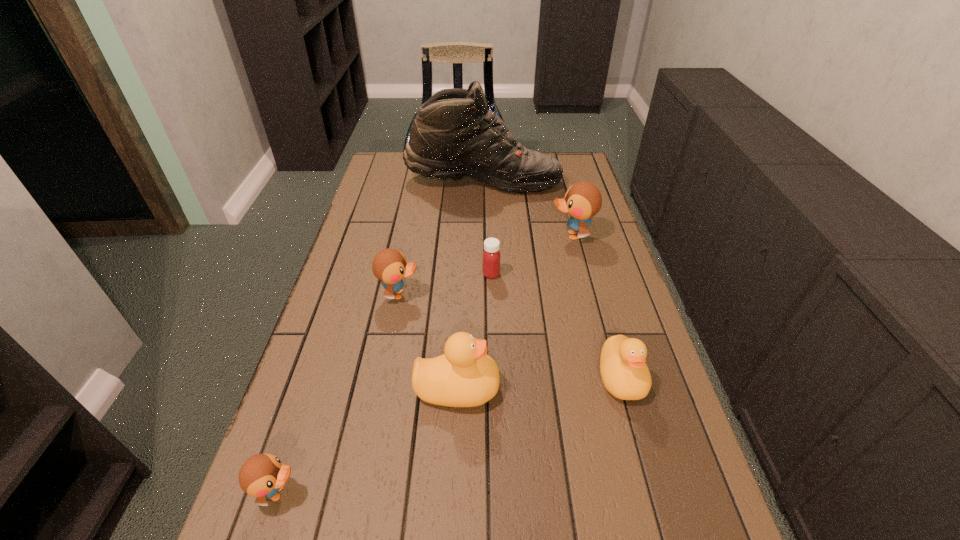
This screenshot has width=960, height=540. What are the coordinates of `the farthest object` in the screenshot? It's located at (454, 135).

Locate an element on the screen. the tallest object is located at coordinates (454, 135).

The width and height of the screenshot is (960, 540). I want to click on the biggest blue duck, so click(583, 200).

Where is `the farthest blue duck`? the farthest blue duck is located at coordinates pos(583,200).

Find the location of a particular element. the left yellow duck is located at coordinates (464, 376).

You are a GUI agent. You are given a task and a screenshot of the screen. Output one action in this format:
    pyautogui.click(x=<x>, y=<y>)
    Task: Click on the bigger yellow duck
    The image size is (960, 540).
    Given the screenshot: What is the action you would take?
    464,376

Find the location of `the second duck from left to right`. the second duck from left to right is located at coordinates (390, 266).

The image size is (960, 540). Identify the location of the second blue duck from left to right. (390, 266).

At what (x,y) coordinates should I click in order to perform the action: click on the right yellow duck. Please return your answer as a coordinate pair (x, y). This screenshot has width=960, height=540. Looking at the image, I should click on (625, 375).

Find the location of `the third farthest object`. the third farthest object is located at coordinates (491, 256).